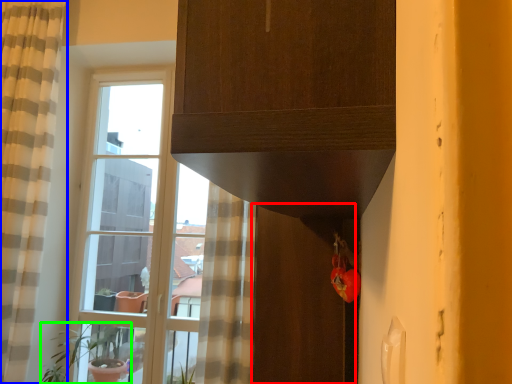
Question: Which is nearer to the screen door (highlighted by a red box)? curtain (highlighted by a blue box) or houseplant (highlighted by a green box).

Choices:
 (A) curtain
 (B) houseplant

Answer: (A)